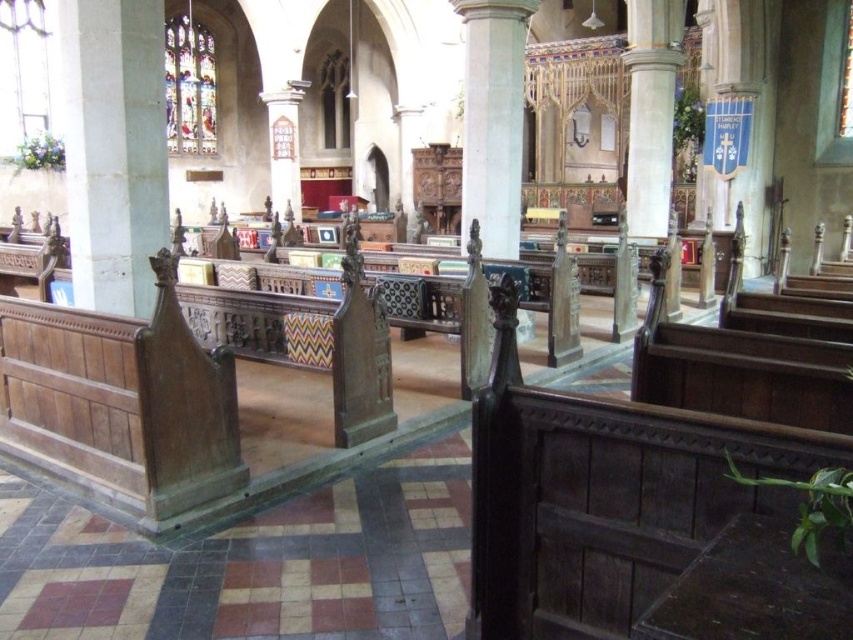
From the picture: You are standing in the nave of the church looking towards the altar. Which object is positioned to the left of the other between the white stone pillar at left and the white stone column at center?

The white stone pillar at left is positioned to the left of the white stone column at center.

You are standing in the nave of the church and want to locate the white stone pillar at left. According to the coordinates provided, where would you find it in relation to your current position?

The white stone pillar at left is located at coordinates point 0.233 on the x axis and 0.135 on the y axis relative to your current position.

You are standing at the entrance of the church and notice two white stone structures ahead. The first is the white stone pillar at left, and the second is the white stone column at center. Which of these two structures is shorter?

The white stone pillar at left is shorter than the white stone column at center.